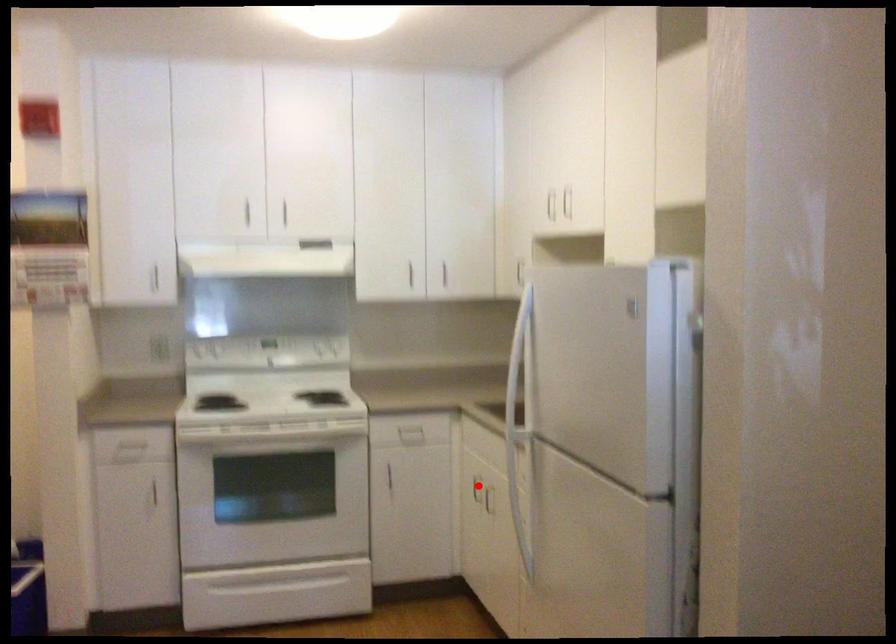
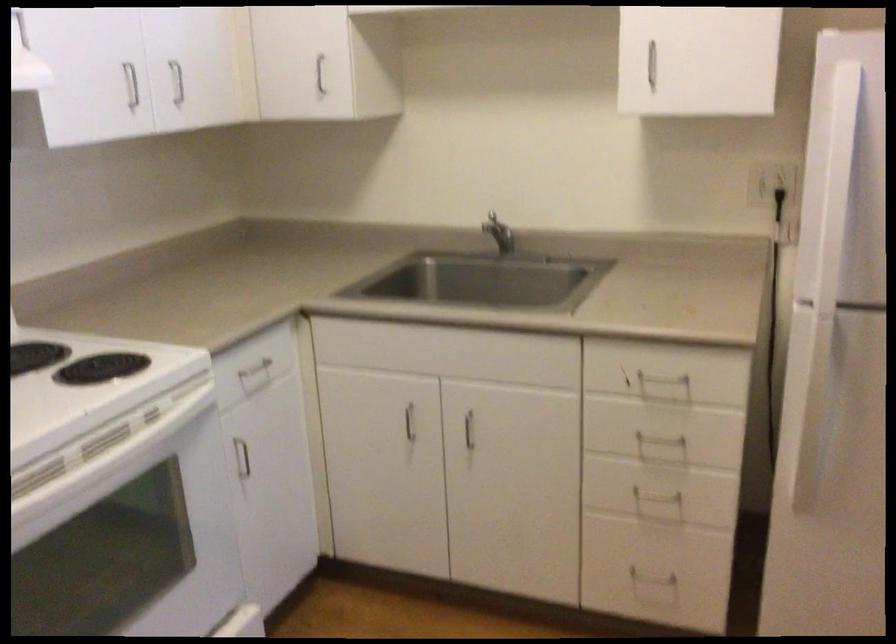
Question: I am providing you with two images of the same scene from different viewpoints. Image1 has a red point marked. In image2, the corresponding 3D location appears at what relative position? Reply with the corresponding letter.

Choices:
 (A) Closer
 (B) Farther

Answer: (A)